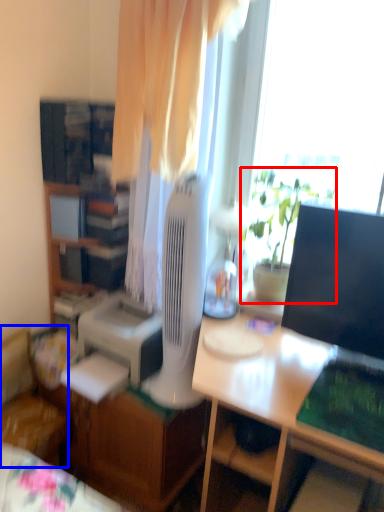
Question: Among these objects, which one is farthest to the camera, houseplant (highlighted by a red box) or chair (highlighted by a blue box)?

Choices:
 (A) houseplant
 (B) chair

Answer: (B)